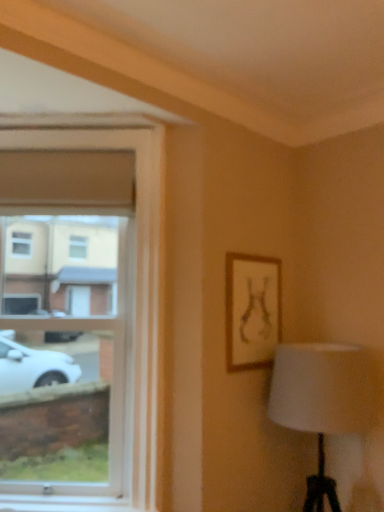
Question: Considering the relative sizes of clear glass window at left and wooden frame at upper right in the image provided, is clear glass window at left smaller than wooden frame at upper right?

Choices:
 (A) no
 (B) yes

Answer: (A)

Question: Would you consider clear glass window at left to be distant from wooden frame at upper right?

Choices:
 (A) yes
 (B) no

Answer: (B)

Question: Is clear glass window at left looking in the opposite direction of wooden frame at upper right?

Choices:
 (A) yes
 (B) no

Answer: (B)

Question: Can you confirm if clear glass window at left is positioned to the right of wooden frame at upper right?

Choices:
 (A) no
 (B) yes

Answer: (A)

Question: From the image's perspective, does clear glass window at left appear higher than wooden frame at upper right?

Choices:
 (A) no
 (B) yes

Answer: (B)

Question: Does clear glass window at left come behind wooden frame at upper right?

Choices:
 (A) no
 (B) yes

Answer: (A)

Question: Is wooden frame at upper right to the left of clear glass window at left from the viewer's perspective?

Choices:
 (A) no
 (B) yes

Answer: (A)

Question: From a real-world perspective, is wooden frame at upper right located higher than clear glass window at left?

Choices:
 (A) no
 (B) yes

Answer: (A)

Question: Can you confirm if wooden frame at upper right is taller than clear glass window at left?

Choices:
 (A) yes
 (B) no

Answer: (B)

Question: Would you consider wooden frame at upper right to be distant from clear glass window at left?

Choices:
 (A) no
 (B) yes

Answer: (A)

Question: Considering the relative positions of wooden frame at upper right and clear glass window at left in the image provided, is wooden frame at upper right to the right of clear glass window at left from the viewer's perspective?

Choices:
 (A) yes
 (B) no

Answer: (A)

Question: Is wooden frame at upper right looking in the opposite direction of clear glass window at left?

Choices:
 (A) no
 (B) yes

Answer: (A)

Question: Does point (254, 273) appear closer or farther from the camera than point (147, 321)?

Choices:
 (A) farther
 (B) closer

Answer: (A)